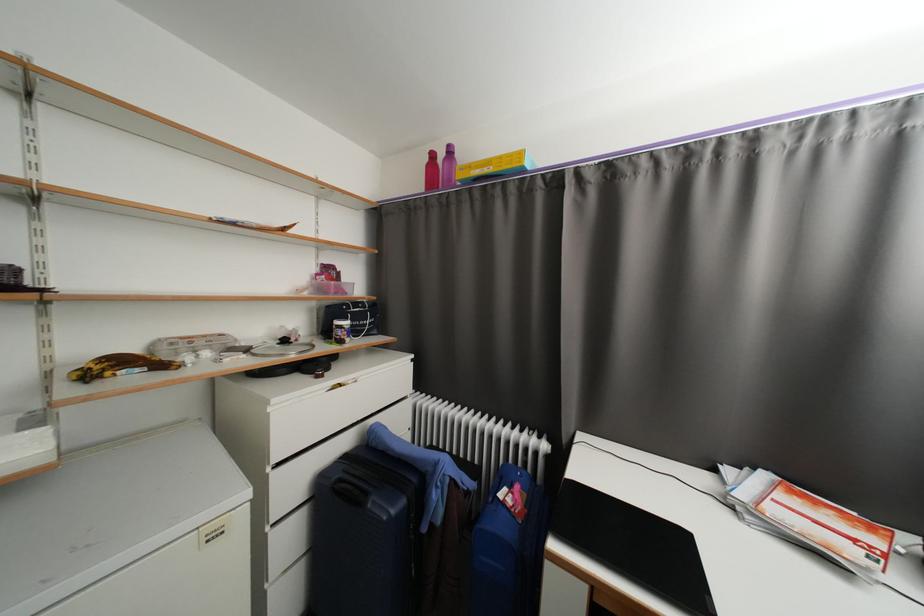
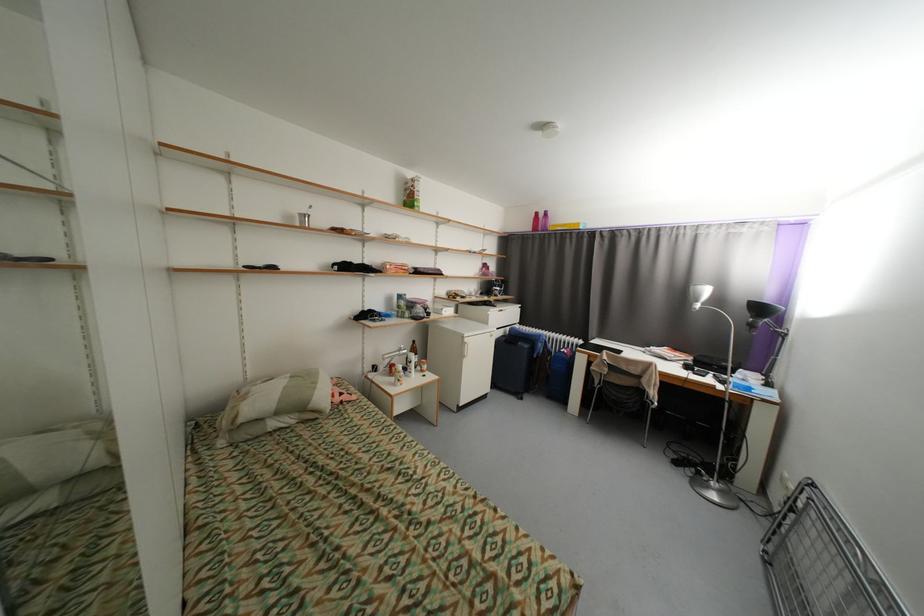
Where in the second image is the point corresponding to the point at 439,156 from the first image?

(542, 215)